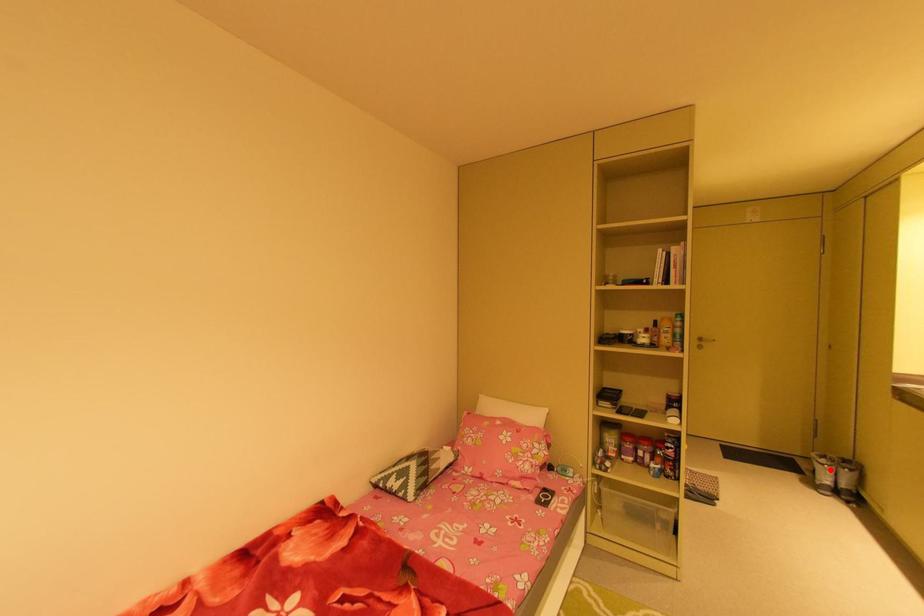
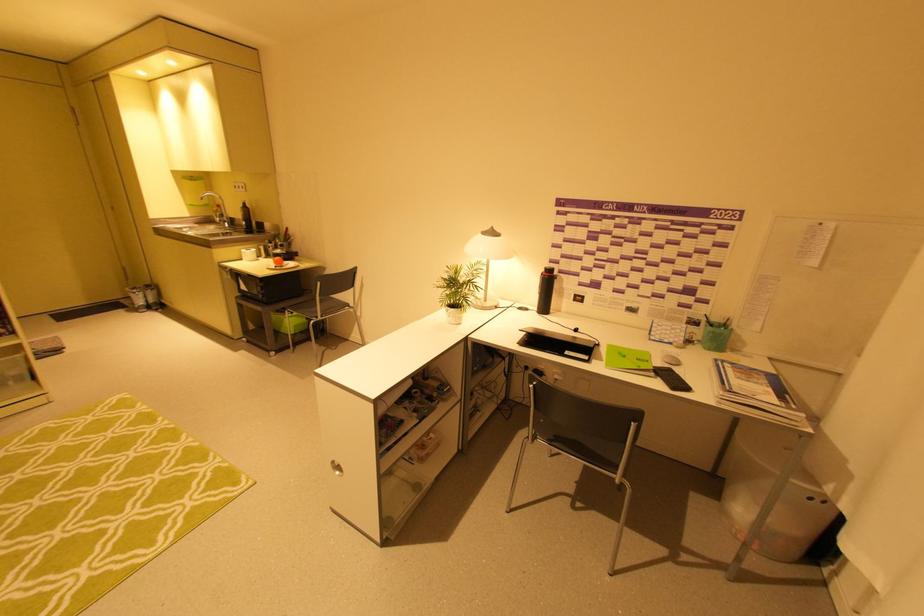
Locate, in the second image, the point that corresponds to the highlighted location in the first image.

(142, 296)